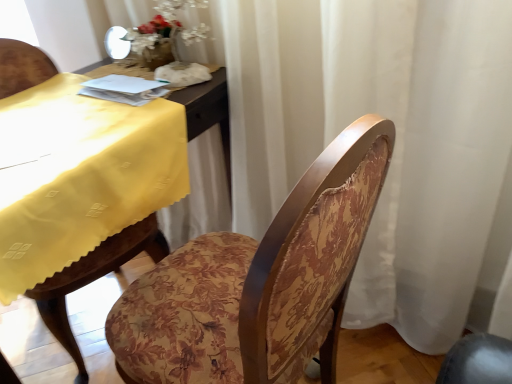
Question: Is floral fabric chair at center facing away from yellow fabric table at left?

Choices:
 (A) no
 (B) yes

Answer: (A)

Question: From a real-world perspective, is floral fabric chair at center over yellow fabric table at left?

Choices:
 (A) no
 (B) yes

Answer: (A)

Question: Is floral fabric chair at center surrounding yellow fabric table at left?

Choices:
 (A) no
 (B) yes

Answer: (A)

Question: Considering the relative positions of floral fabric chair at center and yellow fabric table at left in the image provided, is floral fabric chair at center to the right of yellow fabric table at left from the viewer's perspective?

Choices:
 (A) no
 (B) yes

Answer: (B)

Question: Considering the relative positions of floral fabric chair at center and yellow fabric table at left in the image provided, is floral fabric chair at center in front of yellow fabric table at left?

Choices:
 (A) yes
 (B) no

Answer: (A)

Question: Does floral fabric chair at center appear on the left side of yellow fabric table at left?

Choices:
 (A) yes
 (B) no

Answer: (B)

Question: Can you confirm if yellow fabric table at left is taller than floral fabric chair at center?

Choices:
 (A) yes
 (B) no

Answer: (B)

Question: Would you say yellow fabric table at left is outside floral fabric chair at center?

Choices:
 (A) no
 (B) yes

Answer: (B)

Question: From a real-world perspective, is yellow fabric table at left physically below floral fabric chair at center?

Choices:
 (A) yes
 (B) no

Answer: (B)

Question: Does yellow fabric table at left have a greater width compared to floral fabric chair at center?

Choices:
 (A) no
 (B) yes

Answer: (B)

Question: Is yellow fabric table at left oriented away from floral fabric chair at center?

Choices:
 (A) yes
 (B) no

Answer: (B)

Question: Considering the relative sizes of yellow fabric table at left and floral fabric chair at center in the image provided, is yellow fabric table at left bigger than floral fabric chair at center?

Choices:
 (A) yes
 (B) no

Answer: (B)

Question: From the image's perspective, is floral fabric chair at center positioned above or below yellow fabric table at left?

Choices:
 (A) above
 (B) below

Answer: (B)